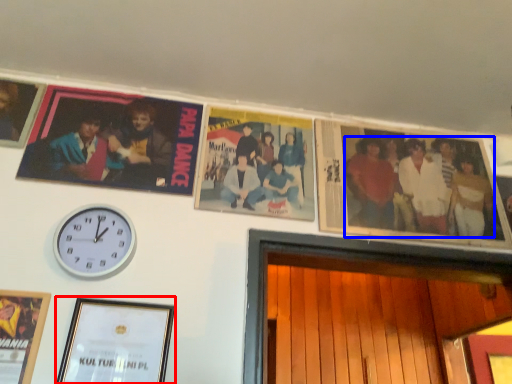
Question: Which object appears farthest to the camera in this image, picture frame (highlighted by a red box) or person (highlighted by a blue box)?

Choices:
 (A) picture frame
 (B) person

Answer: (B)